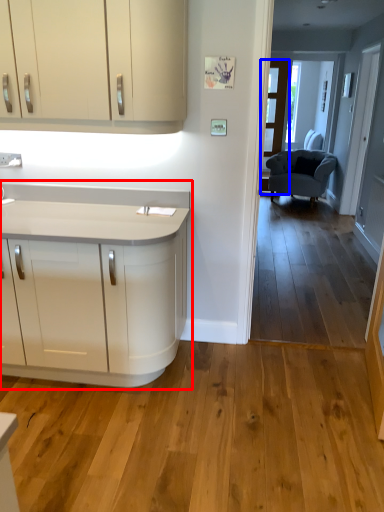
Question: Among these objects, which one is farthest to the camera, countertop (highlighted by a red box) or glass door (highlighted by a blue box)?

Choices:
 (A) countertop
 (B) glass door

Answer: (B)